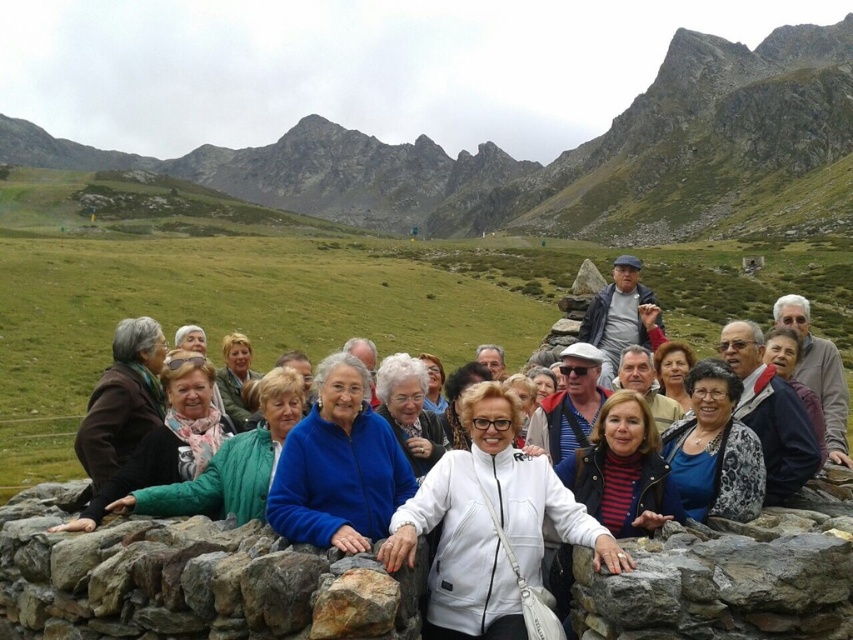
Question: Does white matte jacket at center appear on the left side of rough textured rock at center?

Choices:
 (A) yes
 (B) no

Answer: (B)

Question: Does rugged stone mountain at center have a smaller size compared to gray rough stone at center?

Choices:
 (A) yes
 (B) no

Answer: (B)

Question: Among these points, which one is farthest from the camera?

Choices:
 (A) (828, 586)
 (B) (498, 465)

Answer: (B)

Question: Considering the real-world distances, which object is farthest from the white matte jacket at center?

Choices:
 (A) gray rough stone at center
 (B) rugged stone mountain at center

Answer: (B)

Question: Which object appears closest to the camera in this image?

Choices:
 (A) white matte jacket at center
 (B) gray rough stone at center
 (C) rugged stone mountain at center

Answer: (B)

Question: Where is rugged stone mountain at center located in relation to white matte jacket at center in the image?

Choices:
 (A) left
 (B) right

Answer: (A)